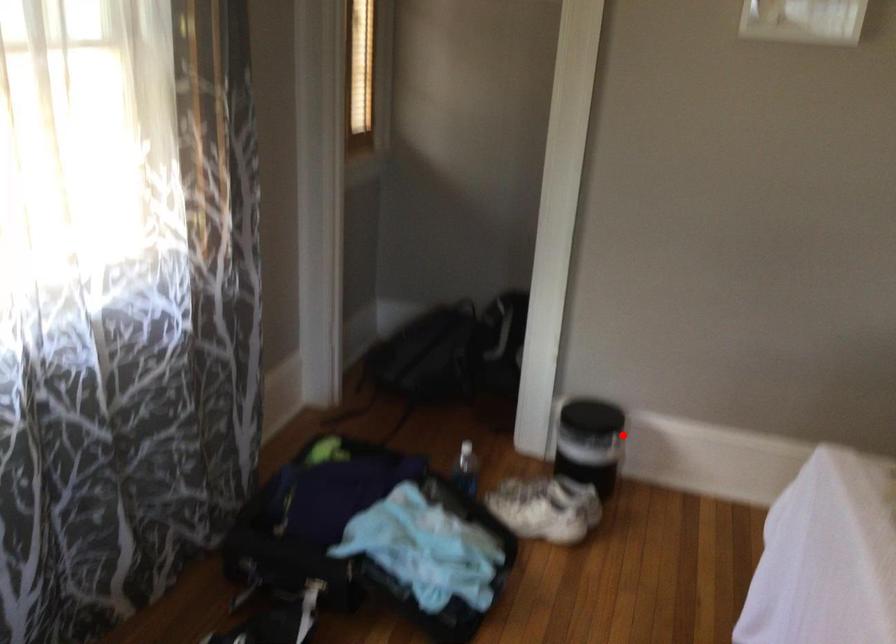
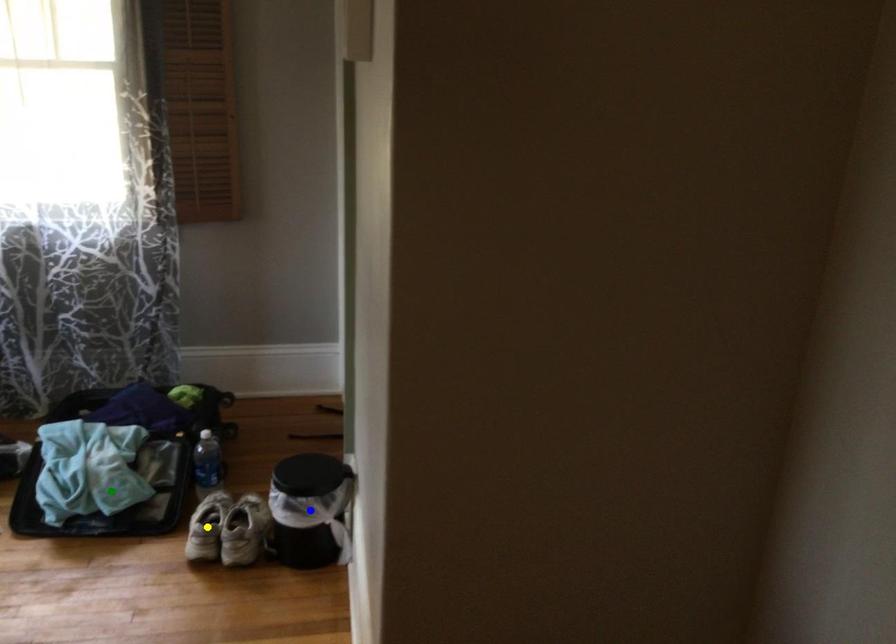
Question: I am providing you with two images of the same scene from different viewpoints. A red point is marked on the first image. You are given multiple points on the second image. Which spot in image 2 lines up with the point in image 1?

Choices:
 (A) green point
 (B) yellow point
 (C) blue point

Answer: (C)